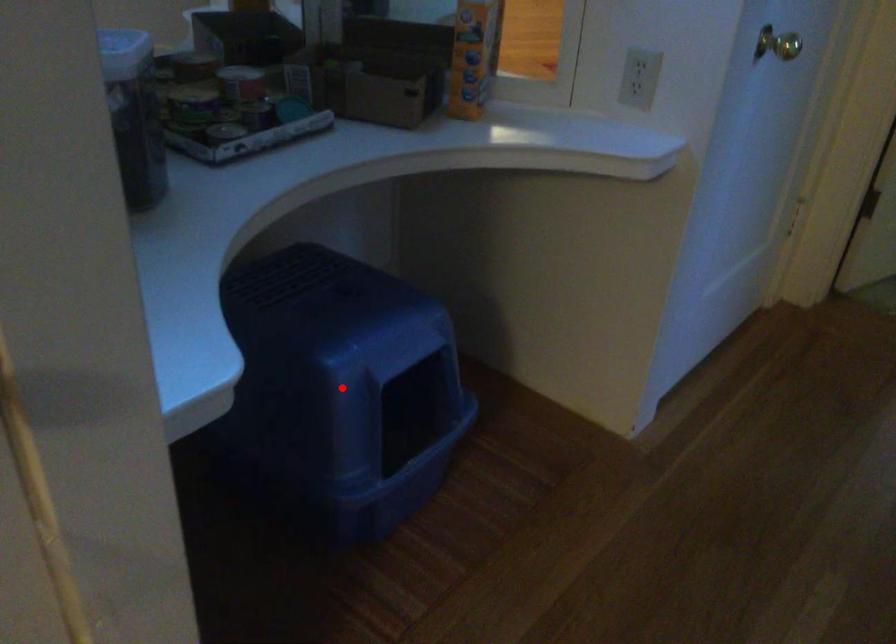
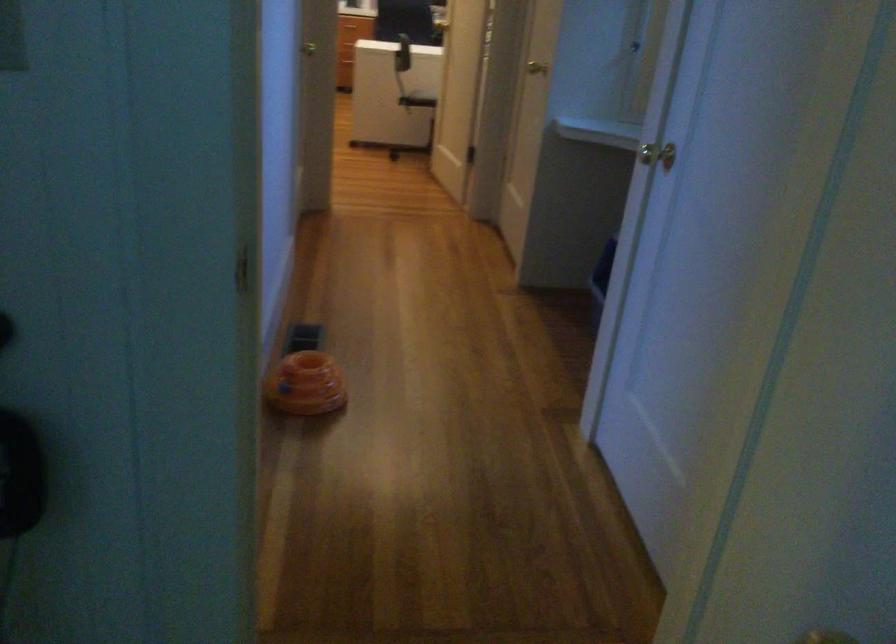
Question: I am providing you with two images of the same scene from different viewpoints. A red point is marked on the first image. Is the red point's position out of view in image 2?

Choices:
 (A) Yes
 (B) No

Answer: (A)